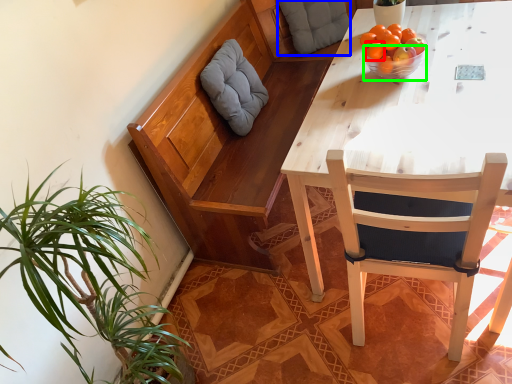
Question: Which is farther away from orange (highlighted by a red box)? pillow (highlighted by a blue box) or bowl (highlighted by a green box)?

Choices:
 (A) pillow
 (B) bowl

Answer: (A)